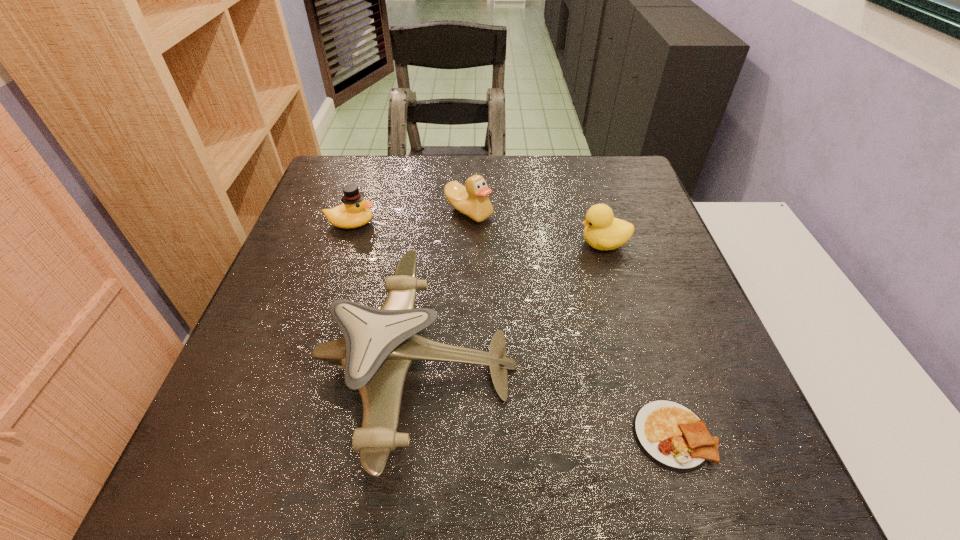
Where is `vacant space that is in between the shortest object and the rightmost duck`? vacant space that is in between the shortest object and the rightmost duck is located at coordinates (638, 340).

This screenshot has height=540, width=960. In order to click on free space between the second duck from left to right and the leftmost duck in this screenshot , I will do `click(410, 218)`.

Identify the location of vacant space in between the rightmost duck and the drone. (511, 305).

Find the location of a particular element. free space that is in between the second duck from left to right and the leftmost duck is located at coordinates (410, 218).

Find the location of a particular element. free space between the omelet and the leftmost duck is located at coordinates (512, 329).

Where is `free spot between the second duck from left to right and the shortest object`? The height and width of the screenshot is (540, 960). free spot between the second duck from left to right and the shortest object is located at coordinates (571, 323).

I want to click on free space between the shortest object and the second duck from right to left, so click(x=571, y=323).

The image size is (960, 540). I want to click on unoccupied area between the rightmost duck and the leftmost duck, so click(x=477, y=233).

Where is `unoccupied area between the drone and the second duck from right to left`? unoccupied area between the drone and the second duck from right to left is located at coordinates (444, 289).

Find the location of `object that stands as the closest to the drone`. object that stands as the closest to the drone is located at coordinates (355, 212).